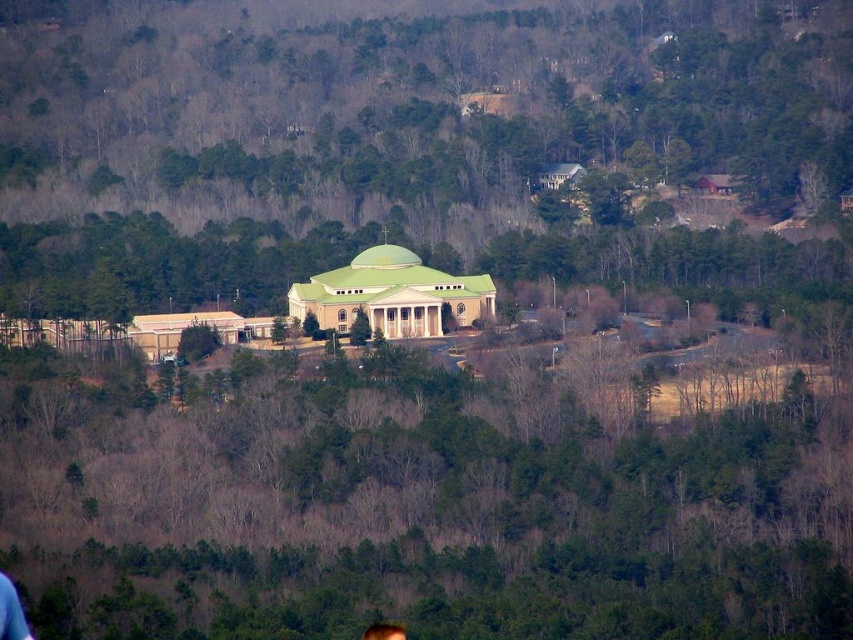
You are standing at the entrance of the classical building with a green dome and white columns. You want to walk directly towards the green leafy tree at center. Which direction should you head?

The green leafy tree at center is located at coordinates 0.777 on the x axis and 0.504 on the y axis. Since the entrance is at the building, which is at the lower part of the image, you should head towards the upper right direction to reach the green leafy tree at center.

You are standing in the parking lot of the green dome building at center and want to take a photo of the blonde hair at center. Since the building is in the way, can you move to the side to get a clear shot?

The green dome building at center is closer to the viewer than the blonde hair at center, so you can move to the side to get a clear shot by going around the building.